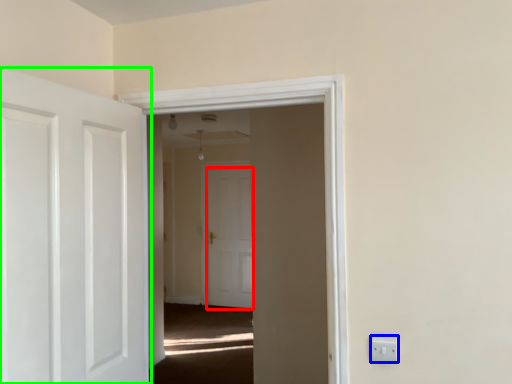
Question: Which object is positioned farthest from door (highlighted by a red box)? Select from electric outlet (highlighted by a blue box) and door (highlighted by a green box).

Choices:
 (A) electric outlet
 (B) door

Answer: (A)